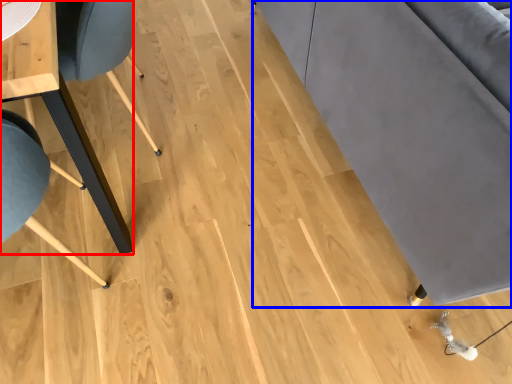
Question: Which point is closer to the camera, table (highlighted by a red box) or couch (highlighted by a blue box)?

Choices:
 (A) table
 (B) couch

Answer: (B)